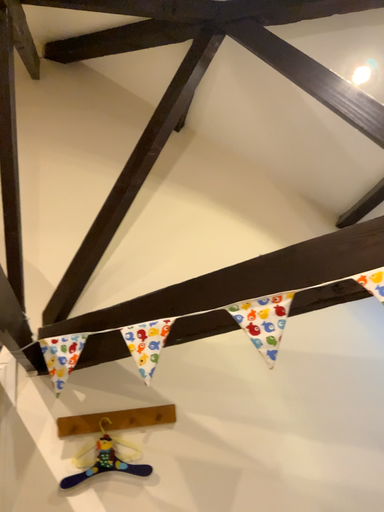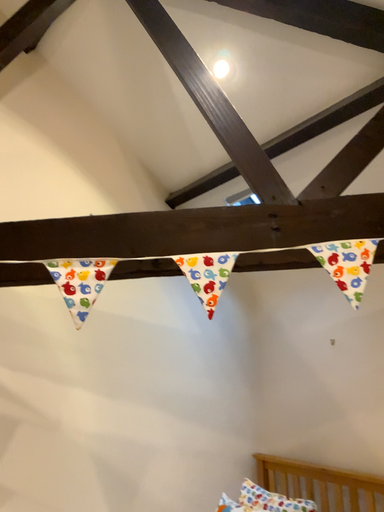
Question: How did the camera likely rotate when shooting the video?

Choices:
 (A) rotated left
 (B) rotated right

Answer: (B)